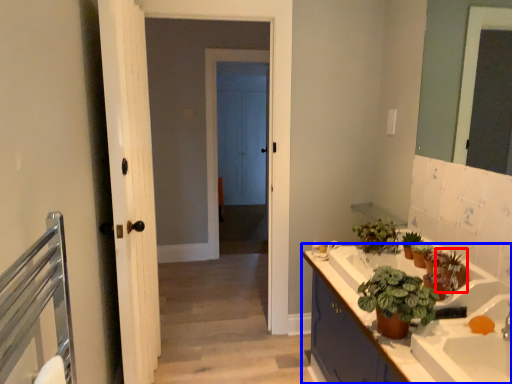
Question: Which of the following is the farthest to the observer, plant (highlighted by a red box) or bathroom cabinet (highlighted by a blue box)?

Choices:
 (A) plant
 (B) bathroom cabinet

Answer: (A)